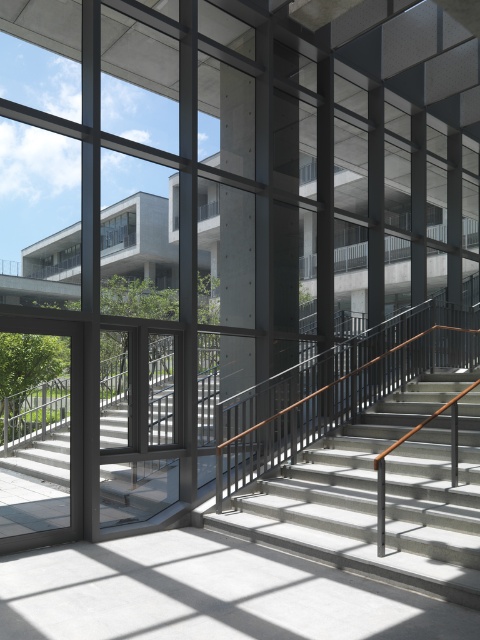
Question: In this image, where is concrete stairs at center located relative to concrete at center?

Choices:
 (A) below
 (B) above

Answer: (A)

Question: Which point is farther to the camera?

Choices:
 (A) polished metal railing at center
 (B) concrete stairs at center
 (C) concrete at center
 (D) clear glass window at upper left

Answer: (D)

Question: Does concrete at center appear over clear glass window at upper left?

Choices:
 (A) yes
 (B) no

Answer: (B)

Question: Which of the following is the farthest from the observer?

Choices:
 (A) concrete at center
 (B) polished metal railing at center
 (C) concrete stairs at center

Answer: (B)

Question: Which object is positioned farthest from the polished metal railing at center?

Choices:
 (A) concrete stairs at center
 (B) concrete at center
 (C) clear glass window at upper left

Answer: (C)

Question: Does polished metal railing at center appear over concrete stairs at center?

Choices:
 (A) yes
 (B) no

Answer: (A)